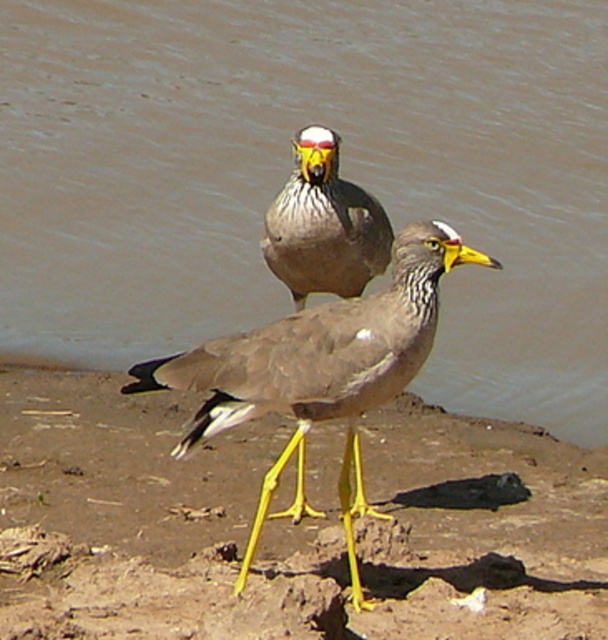
Question: Considering the real-world distances, which object is farthest from the brown water at center?

Choices:
 (A) yellowish-brown mud at center
 (B) brown feathered bird at center

Answer: (B)

Question: Which object is closer to the camera taking this photo?

Choices:
 (A) brown feathered bird at center
 (B) brown water at center
 (C) matte gray bird at center

Answer: (A)

Question: Is yellowish-brown mud at center bigger than brown feathered bird at center?

Choices:
 (A) yes
 (B) no

Answer: (A)

Question: Observing the image, what is the correct spatial positioning of brown water at center in reference to yellowish-brown mud at center?

Choices:
 (A) above
 (B) below

Answer: (A)

Question: Among these points, which one is farthest from the camera?

Choices:
 (A) (77, 412)
 (B) (286, 282)

Answer: (A)

Question: Does brown water at center appear over brown feathered bird at center?

Choices:
 (A) no
 (B) yes

Answer: (B)